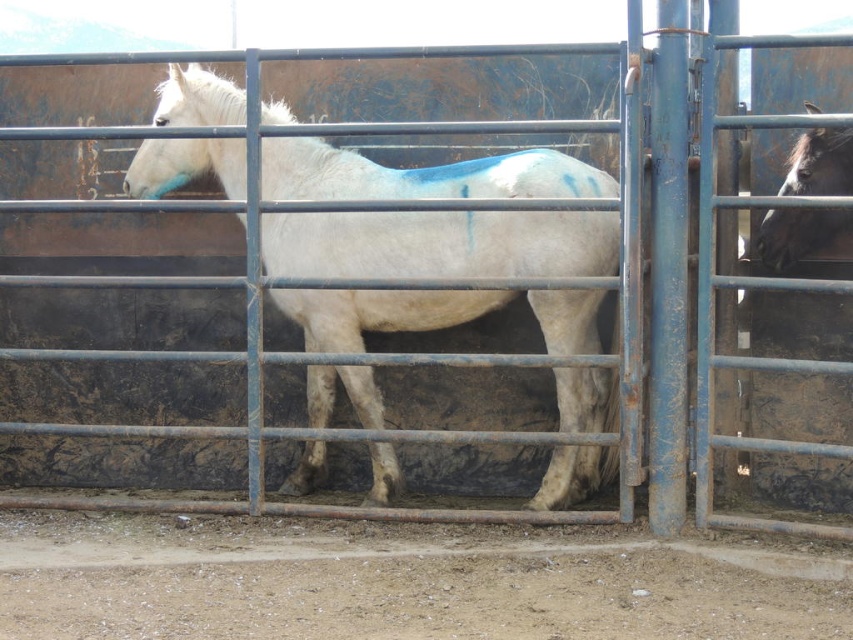
Question: Which object appears farthest from the camera in this image?

Choices:
 (A) black glossy horse at right
 (B) white matte horse at center

Answer: (B)

Question: Is the position of white matte horse at center less distant than that of black glossy horse at right?

Choices:
 (A) yes
 (B) no

Answer: (B)

Question: Is the position of white matte horse at center more distant than that of black glossy horse at right?

Choices:
 (A) yes
 (B) no

Answer: (A)

Question: Does white matte horse at center have a smaller size compared to black glossy horse at right?

Choices:
 (A) no
 (B) yes

Answer: (A)

Question: Which object appears farthest from the camera in this image?

Choices:
 (A) black glossy horse at right
 (B) white matte horse at center

Answer: (B)